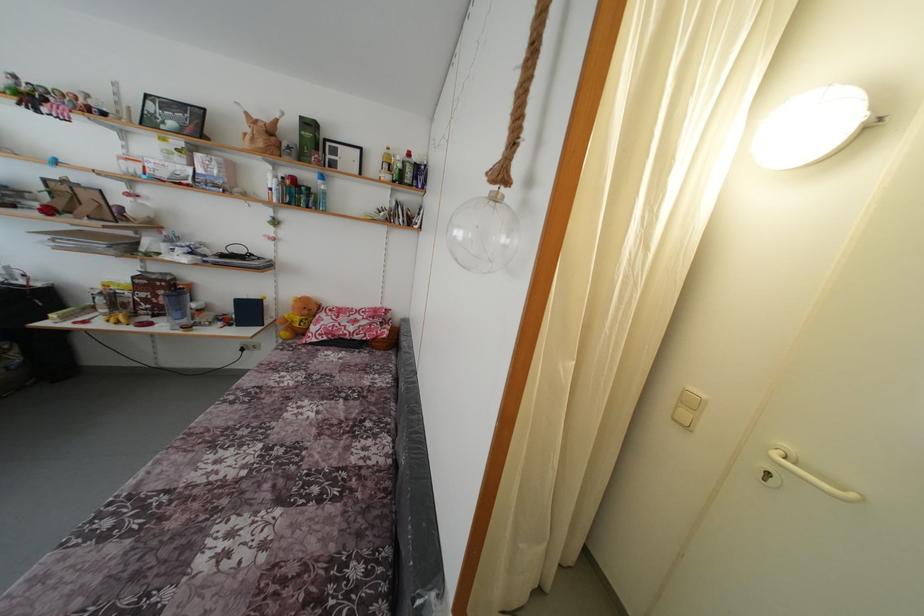
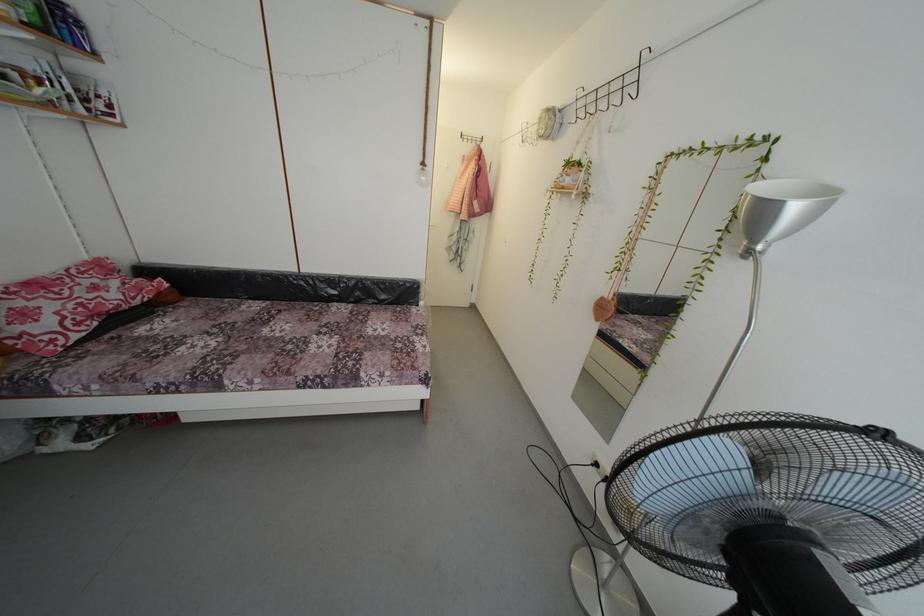
Locate, in the second image, the point that corresponds to [332,321] in the first image.

(34, 306)